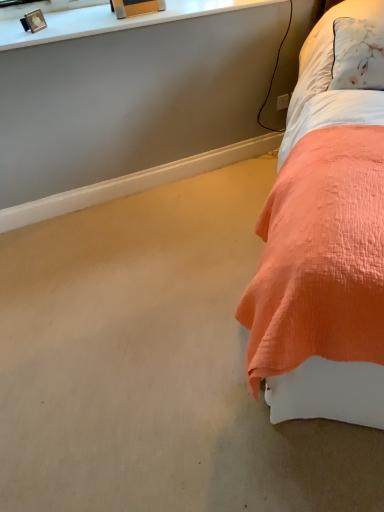
Question: Is coral quilted bed at right bigger than metallic gold picture frame at upper left?

Choices:
 (A) yes
 (B) no

Answer: (A)

Question: From the image's perspective, would you say coral quilted bed at right is shown under metallic gold picture frame at upper left?

Choices:
 (A) yes
 (B) no

Answer: (A)

Question: Considering the relative sizes of coral quilted bed at right and metallic gold picture frame at upper left in the image provided, is coral quilted bed at right smaller than metallic gold picture frame at upper left?

Choices:
 (A) yes
 (B) no

Answer: (B)

Question: Can you confirm if coral quilted bed at right is shorter than metallic gold picture frame at upper left?

Choices:
 (A) yes
 (B) no

Answer: (B)

Question: From a real-world perspective, does coral quilted bed at right stand above metallic gold picture frame at upper left?

Choices:
 (A) no
 (B) yes

Answer: (A)

Question: From their relative heights in the image, would you say coral quilted bed at right is taller or shorter than metallic gold picture frame at upper left?

Choices:
 (A) tall
 (B) short

Answer: (A)

Question: Considering the positions of coral quilted bed at right and metallic gold picture frame at upper left in the image, is coral quilted bed at right wider or thinner than metallic gold picture frame at upper left?

Choices:
 (A) wide
 (B) thin

Answer: (A)

Question: Visually, is coral quilted bed at right positioned to the left or to the right of metallic gold picture frame at upper left?

Choices:
 (A) left
 (B) right

Answer: (B)

Question: Choose the correct answer: Is coral quilted bed at right inside metallic gold picture frame at upper left or outside it?

Choices:
 (A) inside
 (B) outside

Answer: (B)

Question: Looking at the image, does metallic gold picture frame at upper left seem bigger or smaller compared to white plastic power outlet at upper right?

Choices:
 (A) big
 (B) small

Answer: (A)

Question: Which is correct: metallic gold picture frame at upper left is inside white plastic power outlet at upper right, or outside of it?

Choices:
 (A) inside
 (B) outside

Answer: (B)

Question: Considering the positions of point (31, 18) and point (283, 97), is point (31, 18) closer or farther from the camera than point (283, 97)?

Choices:
 (A) closer
 (B) farther

Answer: (A)

Question: In terms of width, does metallic gold picture frame at upper left look wider or thinner when compared to white plastic power outlet at upper right?

Choices:
 (A) thin
 (B) wide

Answer: (B)

Question: In the image, is metallic gold picture frame at upper left positioned in front of or behind coral quilted bed at right?

Choices:
 (A) behind
 (B) front

Answer: (A)

Question: In terms of size, does metallic gold picture frame at upper left appear bigger or smaller than coral quilted bed at right?

Choices:
 (A) big
 (B) small

Answer: (B)